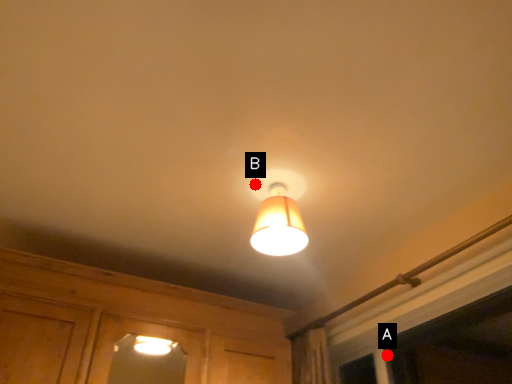
Question: Two points are circled on the image, labeled by A and B beside each circle. Which point is closer to the camera?

Choices:
 (A) A is closer
 (B) B is closer

Answer: (B)